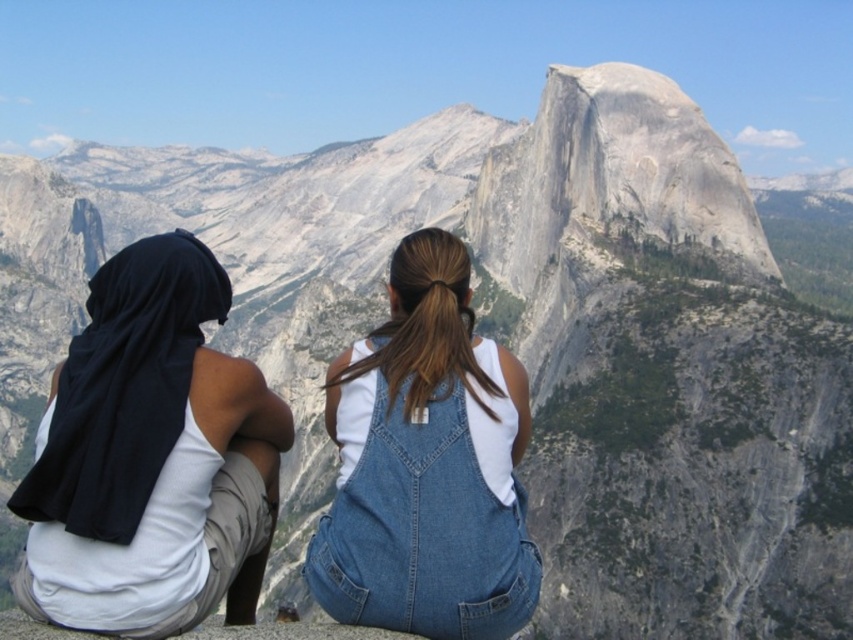
Question: Is white cotton tank top at left bigger than denim overalls at center?

Choices:
 (A) yes
 (B) no

Answer: (A)

Question: Is white cotton tank top at left to the right of denim overalls at center from the viewer's perspective?

Choices:
 (A) yes
 (B) no

Answer: (B)

Question: Which point appears closest to the camera in this image?

Choices:
 (A) (383, 368)
 (B) (225, 368)

Answer: (B)

Question: Can you confirm if white cotton tank top at left is smaller than denim overalls at center?

Choices:
 (A) yes
 (B) no

Answer: (B)